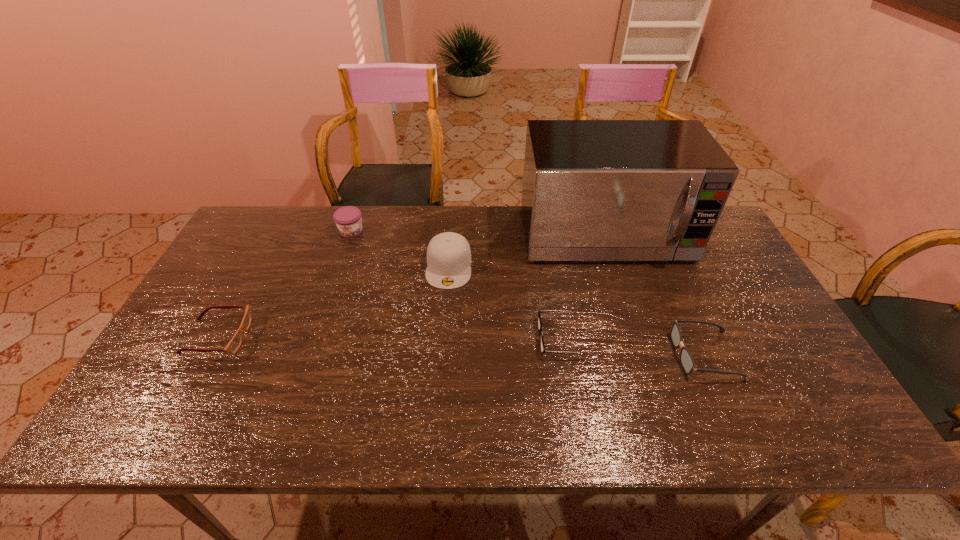
At what (x,y) coordinates should I click in order to perform the action: click on microwave oven. Please return your answer as a coordinate pair (x, y). Image resolution: width=960 pixels, height=540 pixels. Looking at the image, I should click on (593, 190).

You are a GUI agent. You are given a task and a screenshot of the screen. Output one action in this format:
    pyautogui.click(x=<x>, y=<y>)
    Task: Click on the cap
    Image resolution: width=960 pixels, height=540 pixels.
    Given the screenshot: What is the action you would take?
    pyautogui.click(x=448, y=254)

You are a GUI agent. You are given a task and a screenshot of the screen. Output one action in this format:
    pyautogui.click(x=<x>, y=<y>)
    Task: Click on the fifth object from right to left
    This screenshot has width=960, height=540.
    Given the screenshot: What is the action you would take?
    pyautogui.click(x=348, y=219)

You are a GUI agent. You are given a task and a screenshot of the screen. Output one action in this format:
    pyautogui.click(x=<x>, y=<y>)
    Task: Click on the jam
    
    Given the screenshot: What is the action you would take?
    pyautogui.click(x=348, y=219)

Identify the location of the rightmost spectacles. The width and height of the screenshot is (960, 540). (686, 359).

Locate an element on the screen. This screenshot has width=960, height=540. the second shortest spectacles is located at coordinates (234, 344).

At what (x,y) coordinates should I click in order to perform the action: click on the leftmost spectacles. Please return your answer as a coordinate pair (x, y). This screenshot has height=540, width=960. Looking at the image, I should click on (234, 344).

Identify the location of the shortest spectacles. (542, 347).

Where is `the shortest object`? The image size is (960, 540). the shortest object is located at coordinates (542, 347).

Locate an element on the screen. The image size is (960, 540). vacant position located 0.150m with the door open on the microwave oven is located at coordinates (628, 308).